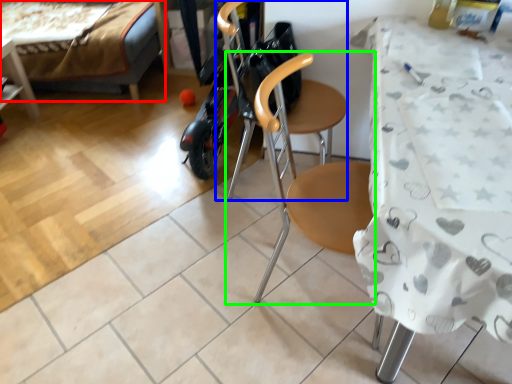
Question: Estimate the real-world distances between objects in this image. Which object is farther from bed (highlighted by a red box), swivel chair (highlighted by a blue box) or chair (highlighted by a green box)?

Choices:
 (A) swivel chair
 (B) chair

Answer: (A)